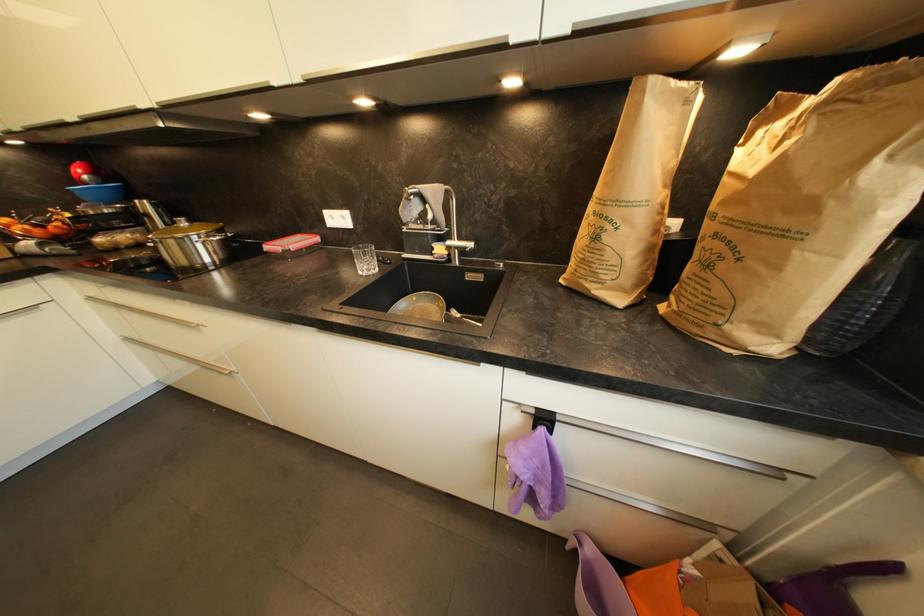
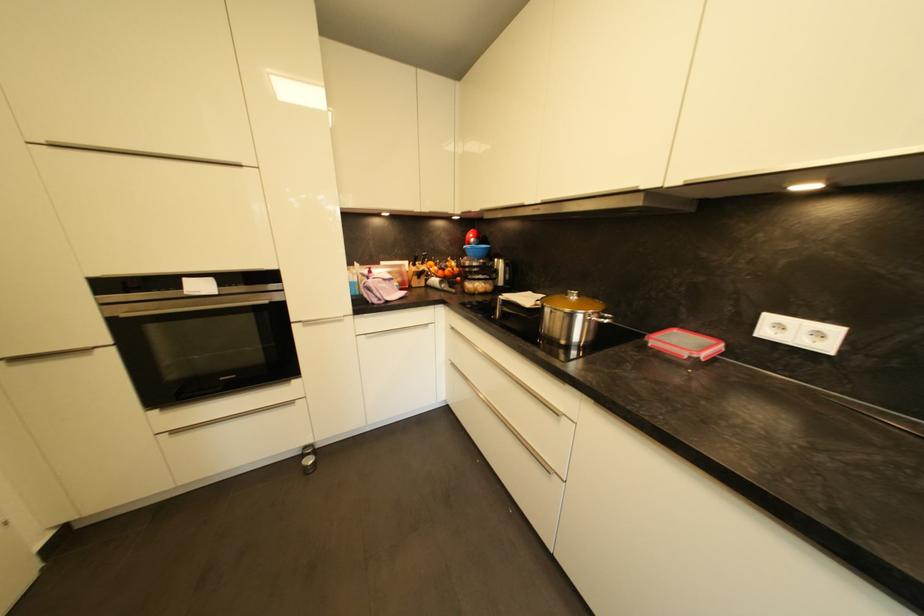
In the second image, find the point that corresponds to (x=220, y=238) in the first image.

(610, 320)